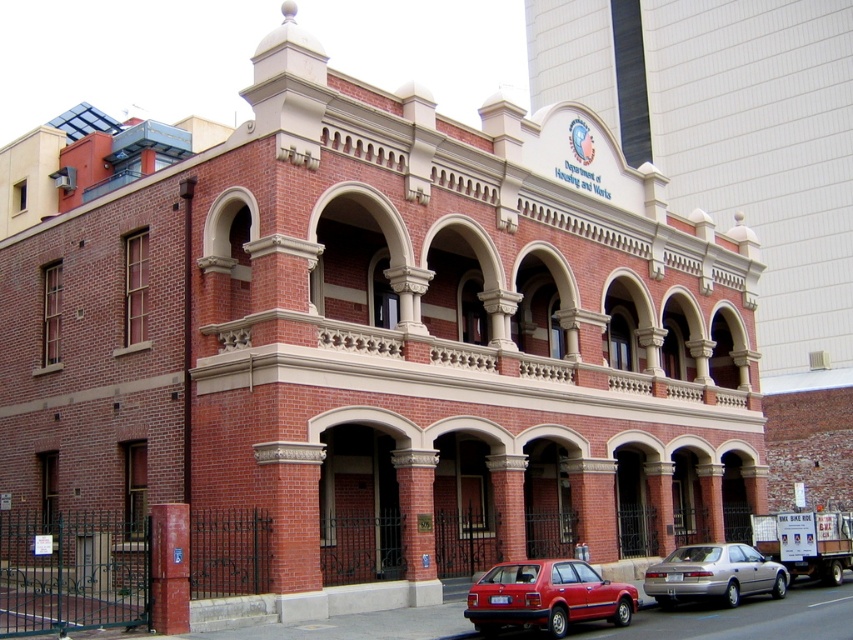
Question: Estimate the real-world distances between objects in this image. Which object is closer to the brick pillar at center?

Choices:
 (A) matte red sedan at lower center
 (B) silver metallic sedan at lower right

Answer: (A)

Question: Does matte red sedan at lower center have a lesser width compared to silver metallic sedan at lower right?

Choices:
 (A) yes
 (B) no

Answer: (A)

Question: Can you confirm if silver metallic sedan at lower right is positioned to the left of brick pillar at center?

Choices:
 (A) yes
 (B) no

Answer: (B)

Question: Is matte red sedan at lower center positioned before silver metallic sedan at lower right?

Choices:
 (A) yes
 (B) no

Answer: (A)

Question: Which object appears closest to the camera in this image?

Choices:
 (A) silver metallic sedan at lower right
 (B) brick pillar at center

Answer: (B)

Question: Which object is the farthest from the brick pillar at center?

Choices:
 (A) silver metallic sedan at lower right
 (B) matte red sedan at lower center

Answer: (A)